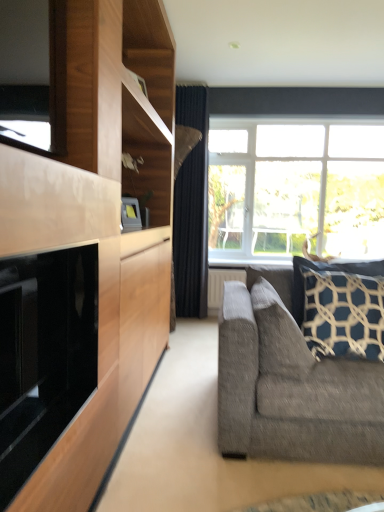
Question: From a real-world perspective, is dark blue textured pillow at right, which is the second pillow in left-to-right order, physically located above or below dark blue textured pillow at right, which ranks as the second pillow in right-to-left order?

Choices:
 (A) below
 (B) above

Answer: (B)

Question: From the image's perspective, is dark blue textured pillow at right, which is the second pillow in left-to-right order, above or below dark blue textured pillow at right, marked as the first pillow in a left-to-right arrangement?

Choices:
 (A) below
 (B) above

Answer: (B)

Question: Which object is the farthest from the black glass fireplace at left?

Choices:
 (A) textured gray couch at right
 (B) dark blue textured pillow at right, which is counted as the 1th pillow, starting from the right
 (C) dark blue textured pillow at right, marked as the first pillow in a left-to-right arrangement
 (D) black velvet curtain at center
 (E) clear glass window at upper center

Answer: (E)

Question: Estimate the real-world distances between objects in this image. Which object is closer to the textured gray couch at right?

Choices:
 (A) dark blue textured pillow at right, which is counted as the 1th pillow, starting from the right
 (B) clear glass window at upper center
 (C) black glass fireplace at left
 (D) black velvet curtain at center
 (E) dark blue textured pillow at right, which ranks as the second pillow in right-to-left order

Answer: (E)